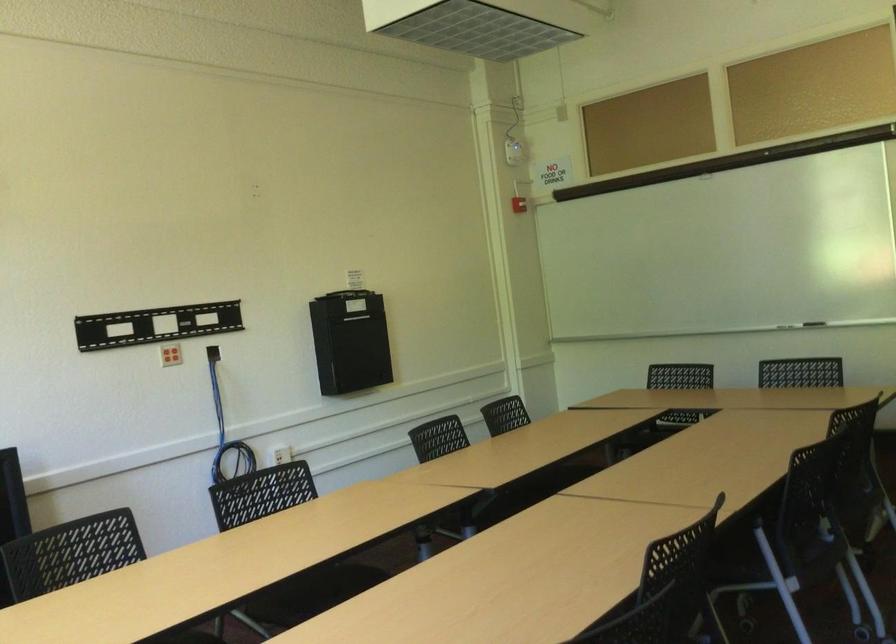
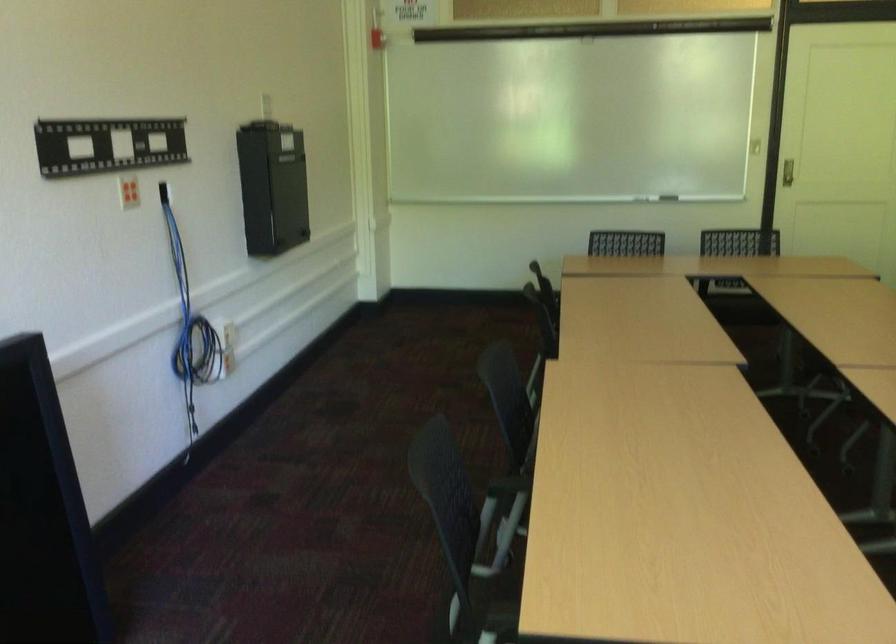
Where in the second image is the point corresponding to the point at 517,207 from the first image?

(375, 38)